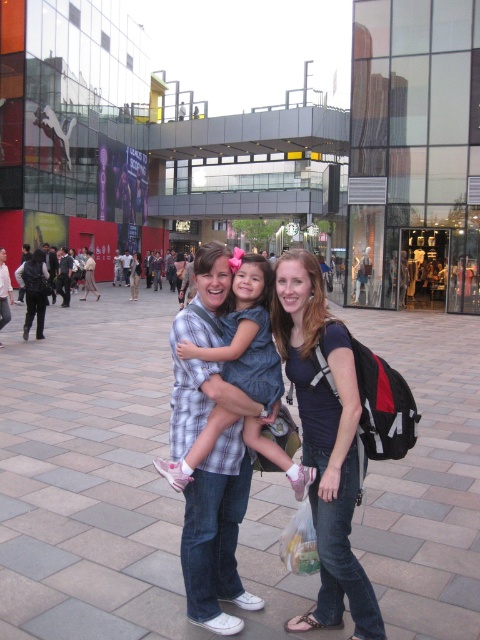
Question: Is matte blue shirt at center to the left of plaid fabric dress at center from the viewer's perspective?

Choices:
 (A) no
 (B) yes

Answer: (A)

Question: Is glass building at center further to camera compared to plaid fabric dress at center?

Choices:
 (A) no
 (B) yes

Answer: (B)

Question: Which object is farther from the camera taking this photo?

Choices:
 (A) matte blue shirt at center
 (B) plaid fabric dress at center
 (C) glass building at center

Answer: (C)

Question: Which object is the closest to the plaid fabric dress at center?

Choices:
 (A) matte blue shirt at center
 (B) glass building at center

Answer: (A)

Question: Which is farther from the plaid fabric dress at center?

Choices:
 (A) glass building at center
 (B) matte blue shirt at center

Answer: (A)

Question: Does matte blue shirt at center have a greater width compared to plaid fabric dress at center?

Choices:
 (A) yes
 (B) no

Answer: (B)